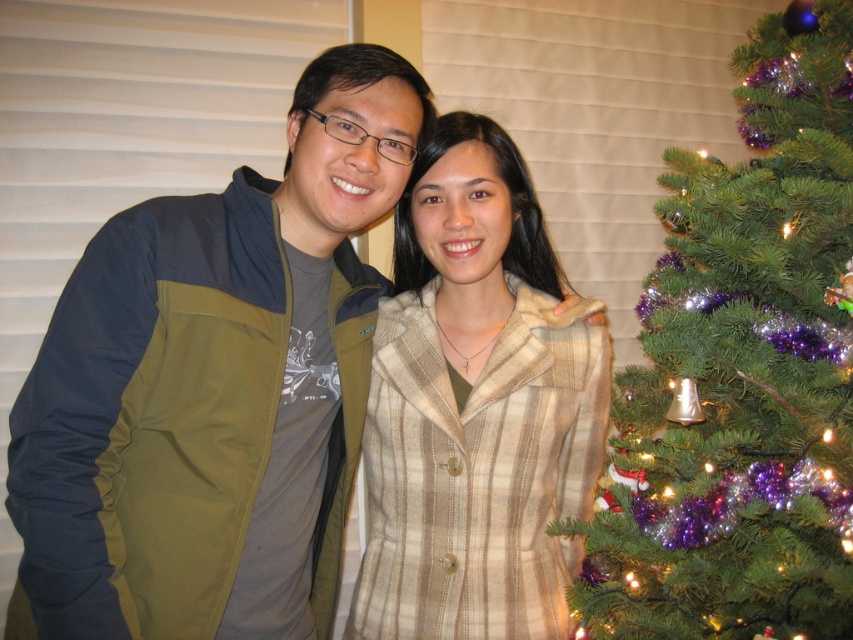
You are taking a photo of the matte olive green jacket at center and the green shiny pine tree at right. Which object is positioned closer to the camera?

The matte olive green jacket at center is closer to the viewer than the green shiny pine tree at right, so it is positioned closer to the camera.

You are a photographer setting up for a group photo. You want to ensure that both the matte olive green jacket at center and the beige plaid coat at center are clearly visible in the photo. Based on their positions, which one might be partially hidden if you focus on the other?

The beige plaid coat at center might be partially hidden because the matte olive green jacket at center is in front of it, so focusing on the matte olive green jacket at center could obscure parts of the beige plaid coat at center.

From the picture: You are a photographer trying to decide where to place a small decorative wreath in the photo. The wreath needs to be placed between the two people so that it doesn t block either of them. Given the sizes of the matte olive green jacket at center and the beige plaid coat at center, which side of the wreath should you position closer to the larger jacket to ensure proper spacing?

The matte olive green jacket at center is bigger than the beige plaid coat at center. To ensure proper spacing, the wreath should be positioned closer to the matte olive green jacket at center so that the larger jacket doesn t block the wreath or the other person.